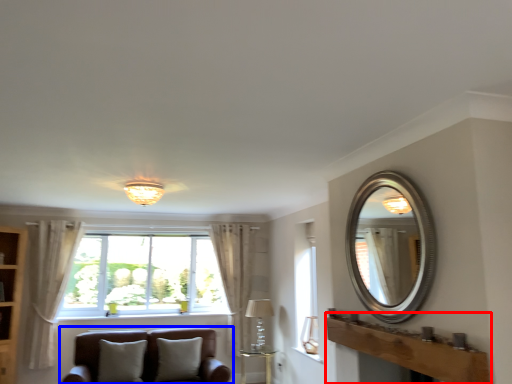
Question: Among these objects, which one is farthest to the camera, mantle (highlighted by a red box) or studio couch (highlighted by a blue box)?

Choices:
 (A) mantle
 (B) studio couch

Answer: (B)